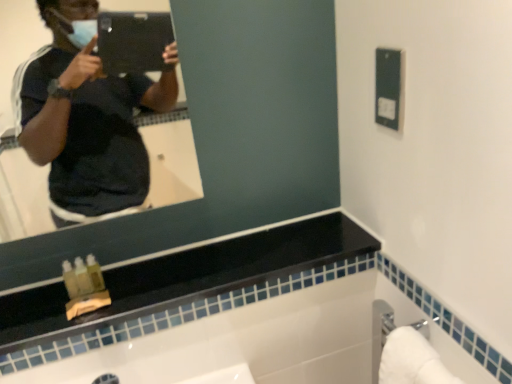
This screenshot has height=384, width=512. Describe the element at coordinates (184, 278) in the screenshot. I see `black glossy counter top at upper center` at that location.

The image size is (512, 384). In order to click on black glossy counter top at upper center in this screenshot , I will do `click(184, 278)`.

Find the location of a particular element. The image size is (512, 384). silver metallic towel bar at lower right is located at coordinates (412, 360).

What is the approximate height of silver metallic towel bar at lower right?

silver metallic towel bar at lower right is 8.32 inches tall.

What do you see at coordinates (412, 360) in the screenshot?
I see `silver metallic towel bar at lower right` at bounding box center [412, 360].

Measure the distance between silver metallic towel bar at lower right and camera.

The distance of silver metallic towel bar at lower right from camera is 26.46 inches.

Locate an element on the screen. black glossy counter top at upper center is located at coordinates (184, 278).

Considering the relative positions of black glossy counter top at upper center and silver metallic towel bar at lower right in the image provided, is black glossy counter top at upper center to the right of silver metallic towel bar at lower right from the viewer's perspective?

In fact, black glossy counter top at upper center is to the left of silver metallic towel bar at lower right.

Which is behind, black glossy counter top at upper center or silver metallic towel bar at lower right?

black glossy counter top at upper center is more distant.

Is point (123, 307) positioned behind point (379, 369)?

Yes, point (123, 307) is behind point (379, 369).

From the image's perspective, is black glossy counter top at upper center located above silver metallic towel bar at lower right?

Yes, from the image's perspective, black glossy counter top at upper center is on top of silver metallic towel bar at lower right.

From a real-world perspective, who is located lower, black glossy counter top at upper center or silver metallic towel bar at lower right?

silver metallic towel bar at lower right.

Is black glossy counter top at upper center wider or thinner than silver metallic towel bar at lower right?

Considering their sizes, black glossy counter top at upper center looks broader than silver metallic towel bar at lower right.

Does black glossy counter top at upper center have a lesser height compared to silver metallic towel bar at lower right?

Yes.

Is black glossy counter top at upper center bigger or smaller than silver metallic towel bar at lower right?

In the image, black glossy counter top at upper center appears to be larger than silver metallic towel bar at lower right.

Is black glossy counter top at upper center not within silver metallic towel bar at lower right?

black glossy counter top at upper center is positioned outside silver metallic towel bar at lower right.

Would you say black glossy counter top at upper center is a long distance from silver metallic towel bar at lower right?

black glossy counter top at upper center is actually quite close to silver metallic towel bar at lower right.

Does black glossy counter top at upper center turn towards silver metallic towel bar at lower right?

No, black glossy counter top at upper center is not oriented towards silver metallic towel bar at lower right.

How different are the orientations of black glossy counter top at upper center and silver metallic towel bar at lower right in degrees?

There is a 89.7-degree angle between the facing directions of black glossy counter top at upper center and silver metallic towel bar at lower right.

How far apart are black glossy counter top at upper center and silver metallic towel bar at lower right?

black glossy counter top at upper center and silver metallic towel bar at lower right are 15.44 inches apart.

At what (x,y) coordinates should I click in order to perform the action: click on counter top that is above the silver metallic towel bar at lower right (from the image's perspective). Please return your answer as a coordinate pair (x, y). Image resolution: width=512 pixels, height=384 pixels. Looking at the image, I should click on (184, 278).

From the picture: Is silver metallic towel bar at lower right at the left side of black glossy counter top at upper center?

No, silver metallic towel bar at lower right is not to the left of black glossy counter top at upper center.

Which object is further away from the camera, silver metallic towel bar at lower right or black glossy counter top at upper center?

black glossy counter top at upper center.

Considering the positions of point (417, 348) and point (164, 294), is point (417, 348) closer or farther from the camera than point (164, 294)?

Point (417, 348) is closer to the camera than point (164, 294).

From the image's perspective, which one is positioned higher, silver metallic towel bar at lower right or black glossy counter top at upper center?

black glossy counter top at upper center appears higher in the image.

From a real-world perspective, who is located lower, silver metallic towel bar at lower right or black glossy counter top at upper center?

silver metallic towel bar at lower right is physically lower.

Between silver metallic towel bar at lower right and black glossy counter top at upper center, which one has larger width?

black glossy counter top at upper center is wider.

In terms of height, does silver metallic towel bar at lower right look taller or shorter compared to black glossy counter top at upper center?

silver metallic towel bar at lower right is taller than black glossy counter top at upper center.

Considering the relative sizes of silver metallic towel bar at lower right and black glossy counter top at upper center in the image provided, is silver metallic towel bar at lower right bigger than black glossy counter top at upper center?

No, silver metallic towel bar at lower right is not bigger than black glossy counter top at upper center.

Is black glossy counter top at upper center surrounded by silver metallic towel bar at lower right?

No, black glossy counter top at upper center is not inside silver metallic towel bar at lower right.

Are silver metallic towel bar at lower right and black glossy counter top at upper center beside each other?

No, silver metallic towel bar at lower right is not next to black glossy counter top at upper center.

Could you tell me if silver metallic towel bar at lower right is facing black glossy counter top at upper center?

No, silver metallic towel bar at lower right is not facing towards black glossy counter top at upper center.

How many degrees apart are the facing directions of silver metallic towel bar at lower right and black glossy counter top at upper center?

89.7 degrees separate the facing orientations of silver metallic towel bar at lower right and black glossy counter top at upper center.

In the image, there is a silver metallic towel bar at lower right. Identify the location of counter top above it (from the image's perspective). (184, 278).

Find the location of a particular element. towel bar lying on the right of black glossy counter top at upper center is located at coordinates (412, 360).

Where is `towel bar that appears below the black glossy counter top at upper center (from the image's perspective)`? Image resolution: width=512 pixels, height=384 pixels. towel bar that appears below the black glossy counter top at upper center (from the image's perspective) is located at coordinates (412, 360).